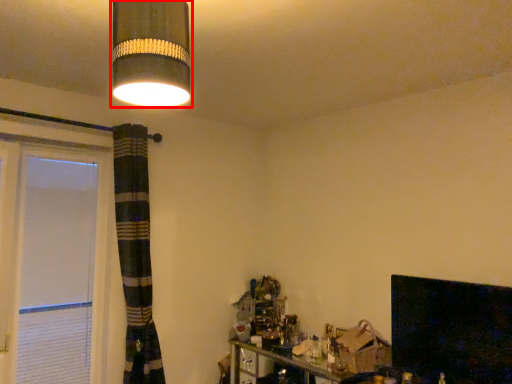
Question: In this image, where is lamp (annotated by the red box) located relative to fireplace?

Choices:
 (A) right
 (B) left

Answer: (B)